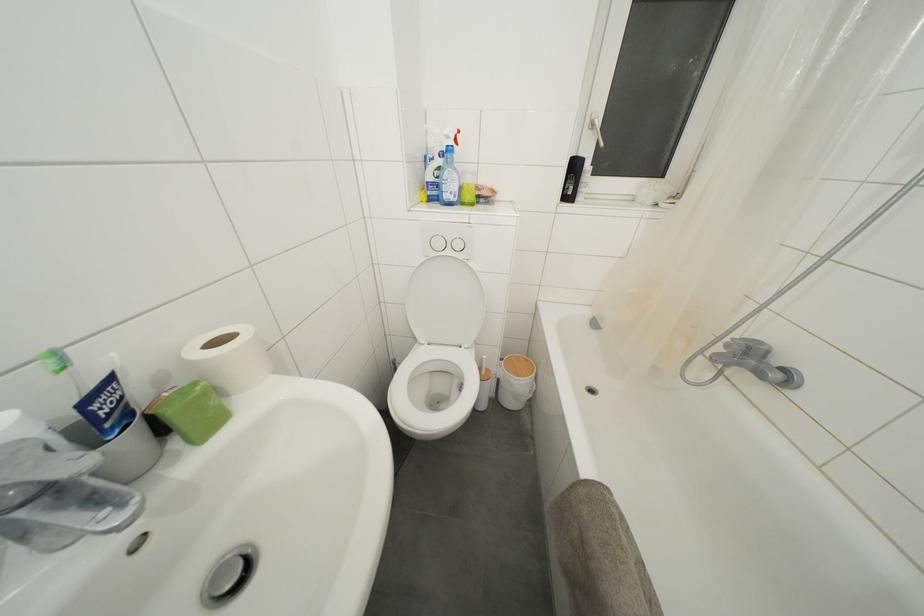
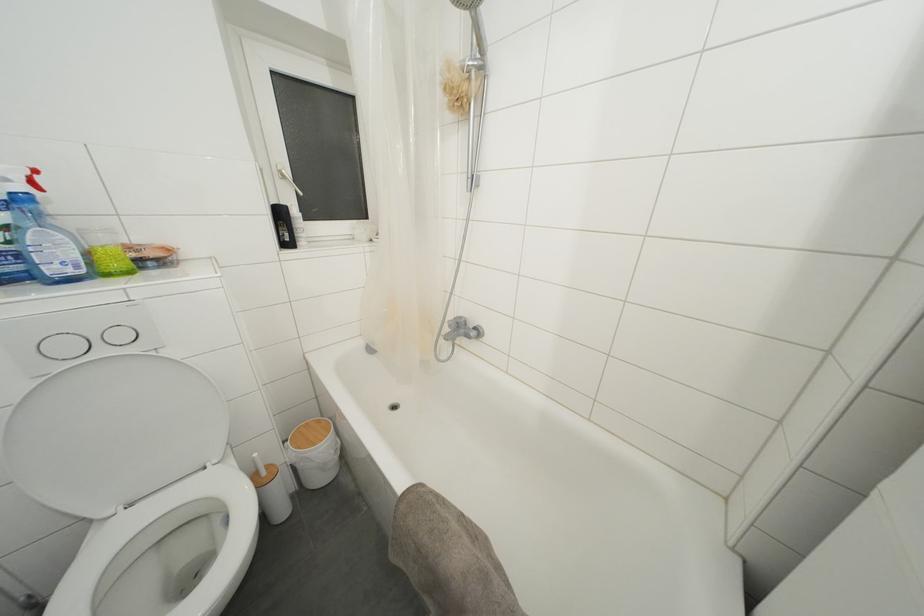
Where in the second image is the point corresponding to the point at 472,185 from the first image?

(108, 245)